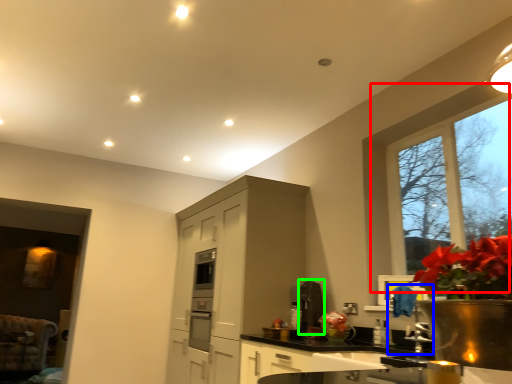
Question: Which is nearer to the window (highlighted by a red box)? faucet (highlighted by a blue box) or appliance (highlighted by a green box).

Choices:
 (A) faucet
 (B) appliance

Answer: (A)